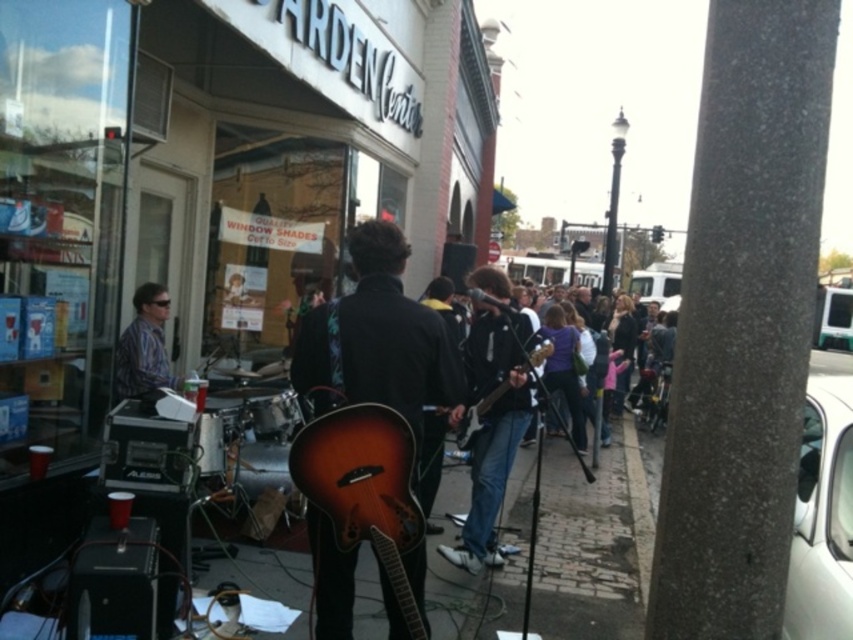
Between wooden acoustic guitar at center and wooden electric guitar at center, which one is positioned lower?

wooden electric guitar at center

Does wooden acoustic guitar at center have a lesser height compared to wooden electric guitar at center?

Incorrect, wooden acoustic guitar at center's height does not fall short of wooden electric guitar at center's.

Does point (389, 593) come behind point (498, 388)?

No, it is in front of (498, 388).

At what (x,y) coordinates should I click in order to perform the action: click on wooden acoustic guitar at center. Please return your answer as a coordinate pair (x, y). This screenshot has width=853, height=640. Looking at the image, I should click on point(376,339).

Is satin wood guitar at center below shiny black guitar at center?

Indeed, satin wood guitar at center is positioned under shiny black guitar at center.

Where is `satin wood guitar at center`? The height and width of the screenshot is (640, 853). satin wood guitar at center is located at coordinates (364, 490).

Who is taller, striped shirt at left or wooden electric guitar at center?

With more height is striped shirt at left.

Is point (154, 298) positioned before point (477, 404)?

No, it is not.

Find the location of a particular element. striped shirt at left is located at coordinates (143, 346).